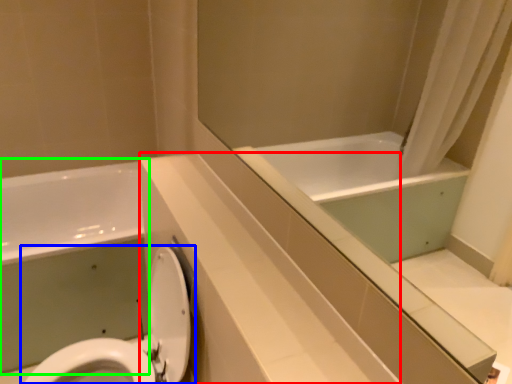
Question: Considering the real-world distances, which object is closest to counter top (highlighted by a red box)? toilet (highlighted by a blue box) or bath (highlighted by a green box).

Choices:
 (A) toilet
 (B) bath

Answer: (A)